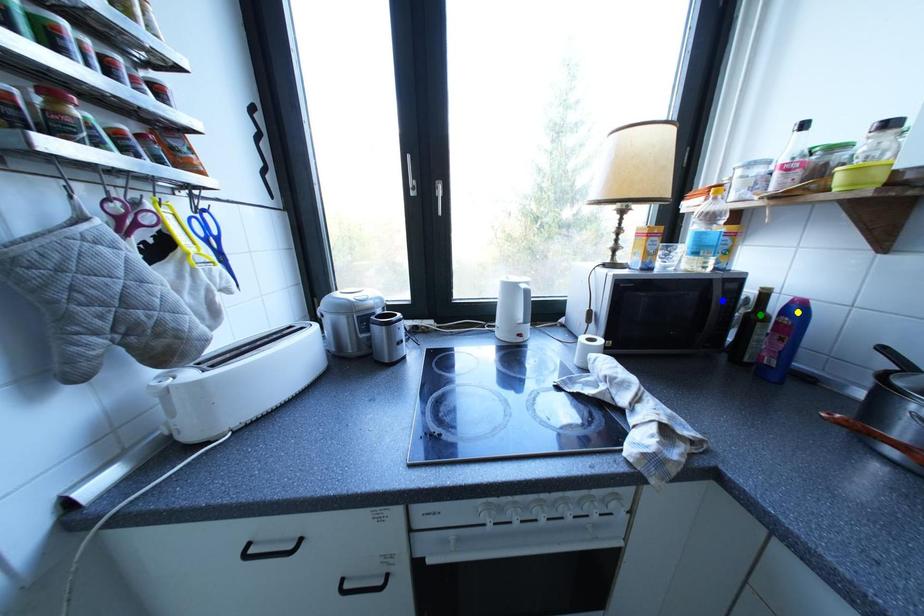
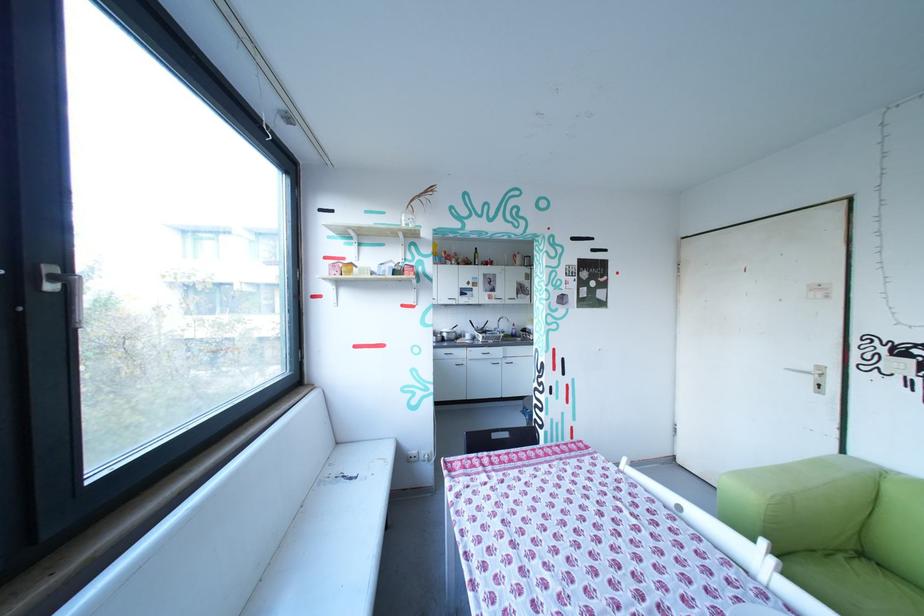
I am providing you with two images of the same scene from different viewpoints. Three points are marked in image1. Which point corresponds to a part or object that is occluded in image2?In image1, three points are marked. Which of them correspond to a part or object that is occluded in image2?Among the three points shown in image1, which one corresponds to a part or object that is no longer visible due to occlusion in image2?

Invisible in image2: blue point, green point, yellow point.